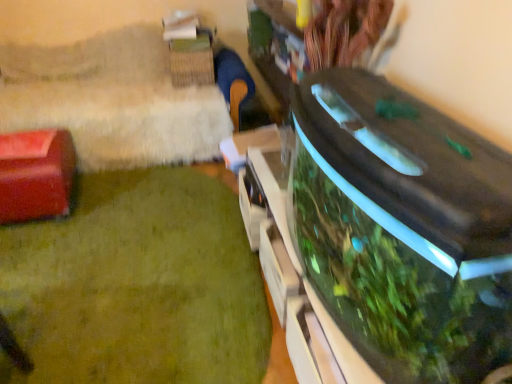
Question: In terms of size, does green glossy aquarium at lower right appear bigger or smaller than transparent glass aquarium at right?

Choices:
 (A) big
 (B) small

Answer: (B)

Question: Considering the positions of green glossy aquarium at lower right and transparent glass aquarium at right in the image, is green glossy aquarium at lower right wider or thinner than transparent glass aquarium at right?

Choices:
 (A) thin
 (B) wide

Answer: (B)

Question: Which of these objects is positioned farthest from the matte red box at left?

Choices:
 (A) green glossy aquarium at lower right
 (B) transparent glass aquarium at right

Answer: (B)

Question: Which object is the farthest from the green glossy aquarium at lower right?

Choices:
 (A) matte red box at left
 (B) transparent glass aquarium at right

Answer: (B)